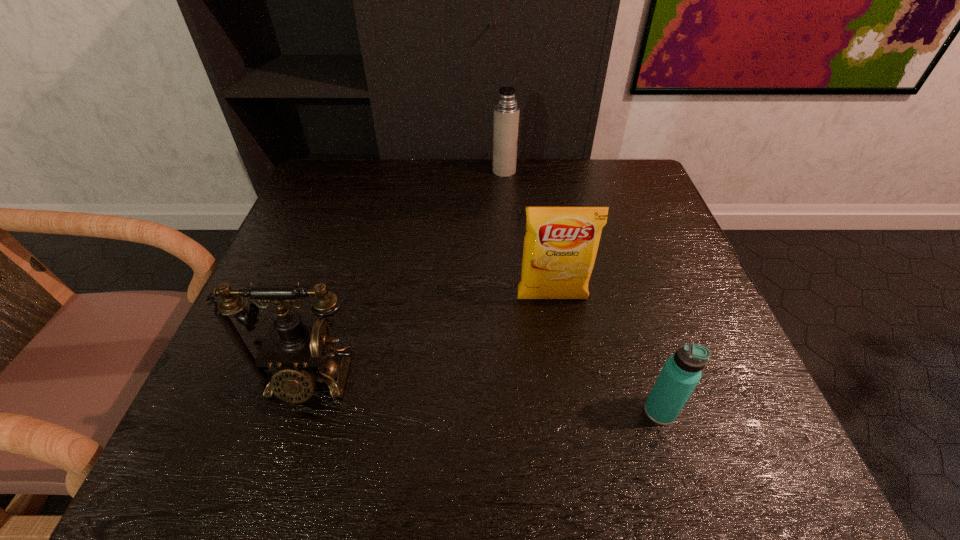
This screenshot has width=960, height=540. In order to click on the left thermos bottle in this screenshot , I will do `click(506, 111)`.

I want to click on the farther thermos bottle, so click(x=506, y=111).

Where is `crisp (potato chip)`? This screenshot has width=960, height=540. crisp (potato chip) is located at coordinates (560, 245).

The width and height of the screenshot is (960, 540). Find the location of `telephone`. telephone is located at coordinates (299, 348).

This screenshot has width=960, height=540. I want to click on the rightmost object, so click(x=681, y=372).

Locate an element on the screen. Image resolution: width=960 pixels, height=540 pixels. the shorter thermos bottle is located at coordinates (681, 372).

The image size is (960, 540). What are the coordinates of `blank area located on the right of the farthest object` in the screenshot? It's located at (578, 171).

At what (x,y) coordinates should I click in order to perform the action: click on free location located 0.340m on the front of the crisp (potato chip) with the logo. Please return your answer as a coordinate pair (x, y). Looking at the image, I should click on (580, 480).

What are the coordinates of `free space located 0.100m on the rotary dial of the leftmost object` in the screenshot? It's located at (276, 474).

Where is `blank space located on the left of the shorter thermos bottle`? This screenshot has height=540, width=960. blank space located on the left of the shorter thermos bottle is located at coordinates (609, 411).